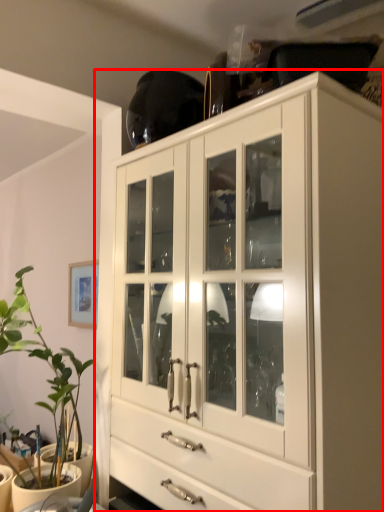
Question: From the image's perspective, where is cabinetry (annotated by the red box) located in relation to houseplant in the image?

Choices:
 (A) above
 (B) below

Answer: (A)